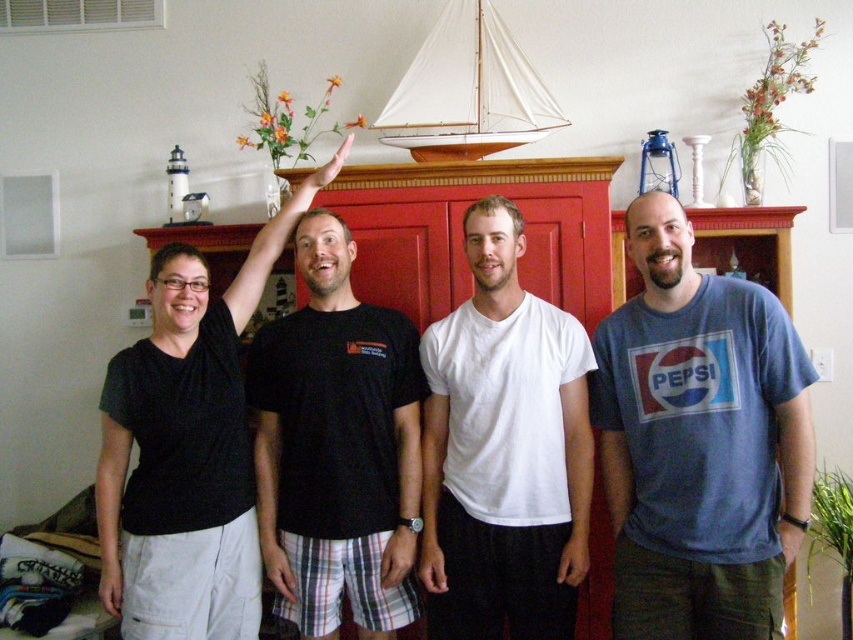
Question: Can you confirm if white matte t-shirt at center is thinner than black matte shirt at upper left?

Choices:
 (A) yes
 (B) no

Answer: (A)

Question: Which point appears farthest from the camera in this image?

Choices:
 (A) (177, 358)
 (B) (491, 100)

Answer: (B)

Question: Among these points, which one is nearest to the camera?

Choices:
 (A) (213, 410)
 (B) (712, 634)
 (C) (497, 627)

Answer: (B)

Question: Estimate the real-world distances between objects in this image. Which object is farther from the black matte shirt at upper left?

Choices:
 (A) white wood sailboat at upper center
 (B) blue cotton t-shirt at right

Answer: (B)

Question: Can you confirm if blue cotton t-shirt at right is wider than white wood sailboat at upper center?

Choices:
 (A) yes
 (B) no

Answer: (B)

Question: Does black cotton t-shirt at center come in front of white wood sailboat at upper center?

Choices:
 (A) no
 (B) yes

Answer: (B)